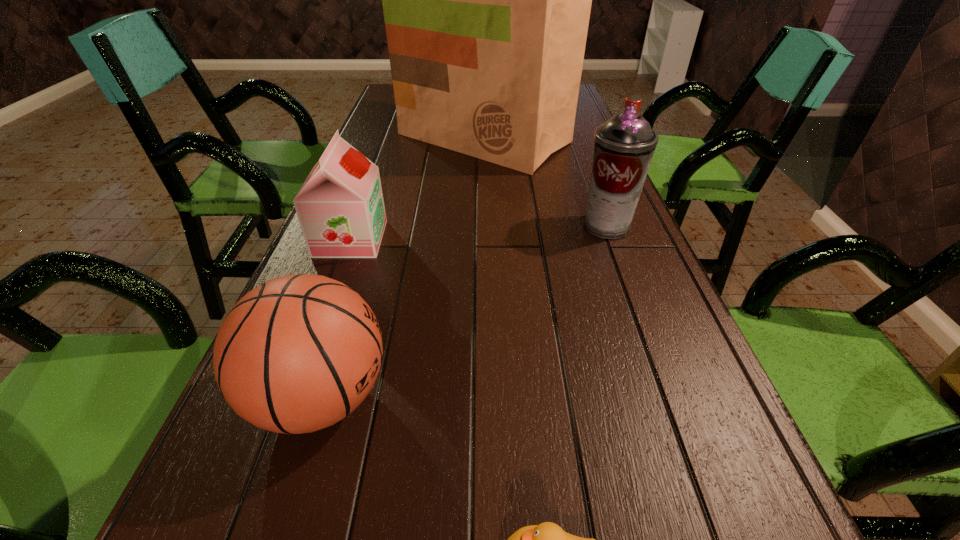
Identify the location of the farthest object. (486, 0).

Locate an element on the screen. the tallest object is located at coordinates (486, 0).

In order to click on aerosol can in this screenshot , I will do `click(624, 145)`.

I want to click on soya milk, so click(340, 207).

Image resolution: width=960 pixels, height=540 pixels. In order to click on basketball in this screenshot , I will do `click(298, 353)`.

Where is `free location located 0.210m on the front of the tallest object`? Image resolution: width=960 pixels, height=540 pixels. free location located 0.210m on the front of the tallest object is located at coordinates (485, 217).

Image resolution: width=960 pixels, height=540 pixels. I want to click on vacant space situated on the front of the second tallest object, so click(620, 264).

Image resolution: width=960 pixels, height=540 pixels. Find the location of `free space located with the cap open on the soya milk`. free space located with the cap open on the soya milk is located at coordinates (546, 239).

I want to click on free space located 0.150m on the surface of the fourth farthest object near the brand logo, so click(486, 397).

Where is `grocery bag located at the left edge`? This screenshot has width=960, height=540. grocery bag located at the left edge is located at coordinates (486, 0).